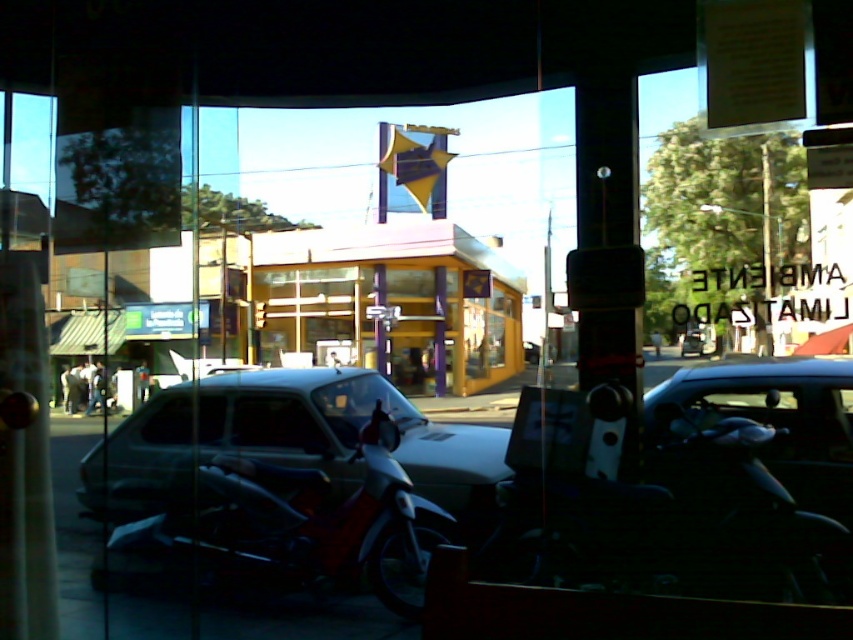
Question: Which object is farther from the camera taking this photo?

Choices:
 (A) shiny red motorcycle at lower left
 (B) metallic silver car at center

Answer: (A)

Question: Does white matte car at center appear on the right side of shiny red motorcycle at lower left?

Choices:
 (A) yes
 (B) no

Answer: (B)

Question: Which point is farther to the camera?

Choices:
 (A) shiny red motorcycle at lower left
 (B) white matte car at center

Answer: (B)

Question: Among these points, which one is nearest to the camera?

Choices:
 (A) coord(254,440)
 (B) coord(242,564)

Answer: (B)

Question: Is white matte car at center thinner than metallic silver car at center?

Choices:
 (A) no
 (B) yes

Answer: (A)

Question: From the image, what is the correct spatial relationship of shiny red motorcycle at lower left in relation to metallic silver car at center?

Choices:
 (A) left
 (B) right

Answer: (A)